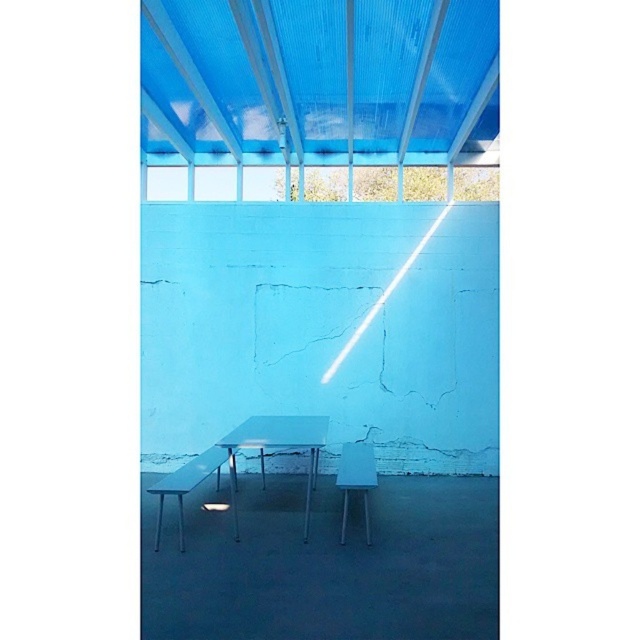
You are a guest entering the room and want to sit down at the table. Which object should you approach first, the metallic silver table at center or the matte blue plastic chair at center, and why?

You should approach the matte blue plastic chair at center first because the metallic silver table at center is taller than the matte blue plastic chair at center, so you need to ensure you can reach the chair to sit down comfortably before approaching the table.

You are a delivery person trying to place a large rectangular package that measures 24 inches in length between the metallic silver table at center and the matte blue plastic chair at center. Based on the scene described, will the package fit in the space between them?

The distance between the metallic silver table at center and the matte blue plastic chair at center is 23.74 inches. Since the package is 24 inches long, it will not fit in the space between them as it is slightly longer than the available distance.